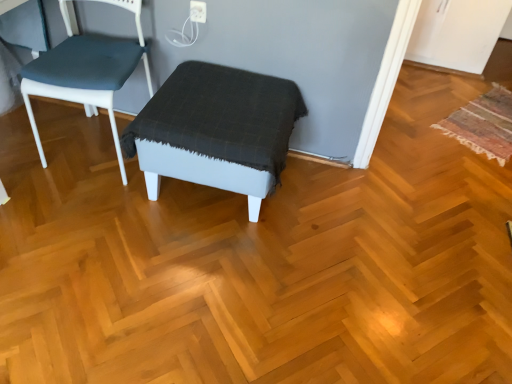
The width and height of the screenshot is (512, 384). Identify the location of free region under matte blue fabric chair at left (from a real-world perspective). (97, 155).